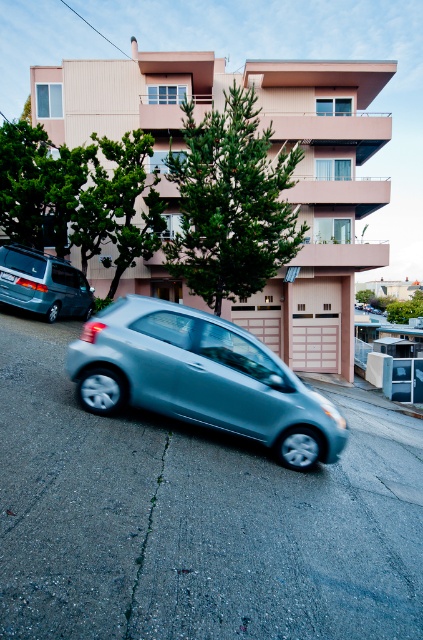
You are standing at the origin point of the image coordinate system. Where is the satin silver car at center located in terms of coordinates?

The satin silver car at center is located at coordinates point (200,378).

You are standing at the point with coordinates point (x=200, y=378). What object are you standing on?

You are standing on the satin silver car at center corresponding to point (x=200, y=378).